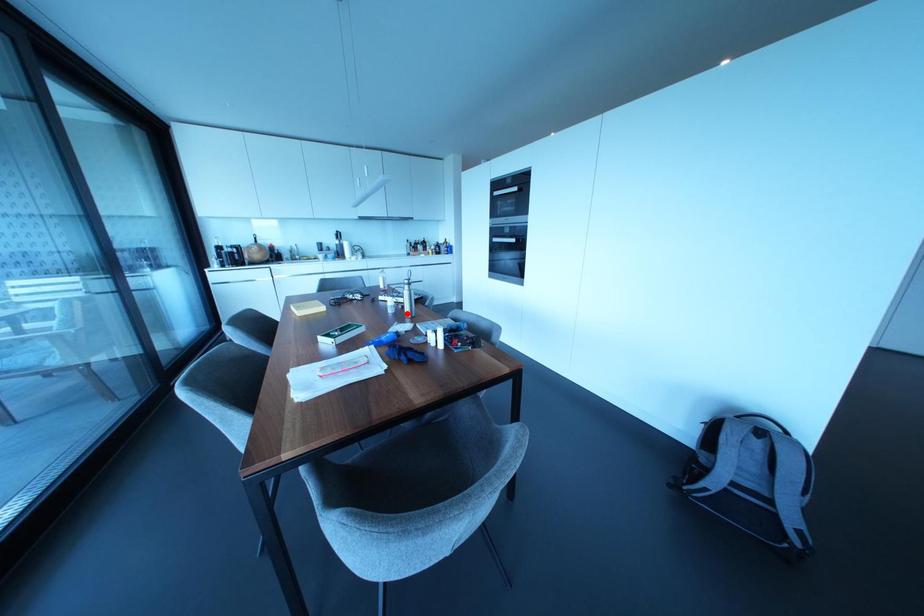
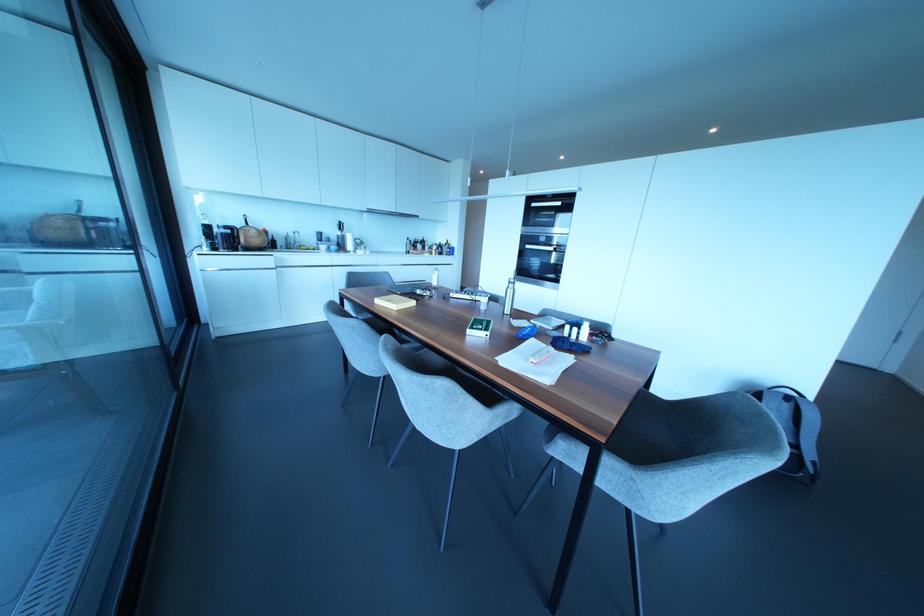
Find the pixel in the second image that matches the highlighted location in the first image.

(506, 310)